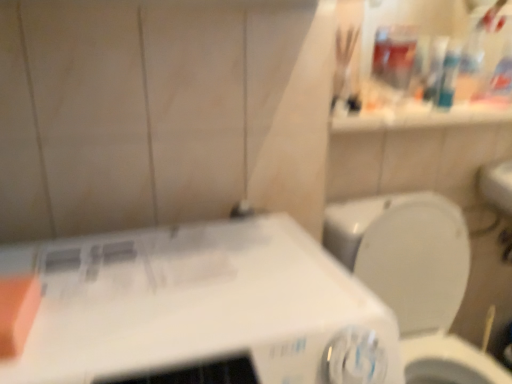
What do you see at coordinates (17, 312) in the screenshot? The height and width of the screenshot is (384, 512). I see `orange matte soap at left` at bounding box center [17, 312].

The height and width of the screenshot is (384, 512). Find the location of `white glossy toilet at right`. white glossy toilet at right is located at coordinates (415, 277).

How different are the orientations of white glossy toilet at right and orange matte soap at left in degrees?

The angular difference between white glossy toilet at right and orange matte soap at left is 3.81 degrees.

Would you say white glossy toilet at right is outside orange matte soap at left?

Yes.

Is white glossy toilet at right with orange matte soap at left?

No, white glossy toilet at right is not with orange matte soap at left.

Is point (1, 281) positioned in front of point (272, 228)?

That is True.

The height and width of the screenshot is (384, 512). Find the location of `appliance on the right side of orange matte soap at left`. appliance on the right side of orange matte soap at left is located at coordinates (201, 308).

In the scene shown: From a real-world perspective, does orange matte soap at left sit lower than white plastic washing machine at lower left?

Actually, orange matte soap at left is physically above white plastic washing machine at lower left in the real world.

Is orange matte soap at left next to white plastic washing machine at lower left?

No, orange matte soap at left is not in contact with white plastic washing machine at lower left.

In order to click on appliance lying above the white glossy toilet at right (from the image's perspective) in this screenshot , I will do `click(201, 308)`.

Is white glossy toilet at right taller than white plastic washing machine at lower left?

Correct, white glossy toilet at right is much taller as white plastic washing machine at lower left.

Is white glossy toilet at right outside of white plastic washing machine at lower left?

That's correct, white glossy toilet at right is outside of white plastic washing machine at lower left.

Is white plastic washing machine at lower left looking in the opposite direction of orange matte soap at left?

No, orange matte soap at left is not at the back of white plastic washing machine at lower left.

How far apart are white plastic washing machine at lower left and orange matte soap at left?

They are 9.58 inches apart.

Does point (101, 376) come behind point (25, 298)?

No, (101, 376) is closer to viewer.

Is white plastic washing machine at lower left shorter than orange matte soap at left?

In fact, white plastic washing machine at lower left may be taller than orange matte soap at left.

Is orange matte soap at left wider than white glossy toilet at right?

No, orange matte soap at left is not wider than white glossy toilet at right.

Who is more distant, orange matte soap at left or white glossy toilet at right?

white glossy toilet at right is further away from the camera.

Is orange matte soap at left to the left or to the right of white glossy toilet at right in the image?

Clearly, orange matte soap at left is on the left of white glossy toilet at right in the image.

Looking at this image, considering the sizes of objects orange matte soap at left and white glossy toilet at right in the image provided, who is shorter, orange matte soap at left or white glossy toilet at right?

orange matte soap at left is shorter.

Is white plastic washing machine at lower left looking in the opposite direction of white glossy toilet at right?

No, white plastic washing machine at lower left is not facing the opposite direction of white glossy toilet at right.

Where is `toilet that appears below the white plastic washing machine at lower left (from the image's perspective)`? The image size is (512, 384). toilet that appears below the white plastic washing machine at lower left (from the image's perspective) is located at coordinates (415, 277).

Which of these two, white plastic washing machine at lower left or white glossy toilet at right, is thinner?

white plastic washing machine at lower left is thinner.

Identify the location of soap lying on the left of white glossy toilet at right. (17, 312).

This screenshot has height=384, width=512. Find the location of `appliance that appears on the right of orange matte soap at left`. appliance that appears on the right of orange matte soap at left is located at coordinates (201, 308).

When comparing their distances from orange matte soap at left, does white glossy toilet at right or white plastic washing machine at lower left seem further?

white glossy toilet at right is positioned further to the anchor orange matte soap at left.

Which object lies nearer to the anchor point white plastic washing machine at lower left, white glossy toilet at right or orange matte soap at left?

orange matte soap at left is closer to white plastic washing machine at lower left.

Which object lies further to the anchor point white glossy toilet at right, orange matte soap at left or white plastic washing machine at lower left?

orange matte soap at left is further to white glossy toilet at right.

Considering their positions, is white plastic washing machine at lower left positioned further to white glossy toilet at right than orange matte soap at left?

Among the two, orange matte soap at left is located further to white glossy toilet at right.

From the image, which object appears to be nearer to white plastic washing machine at lower left, orange matte soap at left or white glossy toilet at right?

Based on the image, orange matte soap at left appears to be nearer to white plastic washing machine at lower left.

Based on their spatial positions, is white plastic washing machine at lower left or white glossy toilet at right closer to orange matte soap at left?

The object closer to orange matte soap at left is white plastic washing machine at lower left.

This screenshot has height=384, width=512. Identify the location of appliance between orange matte soap at left and white glossy toilet at right from left to right. (201, 308).